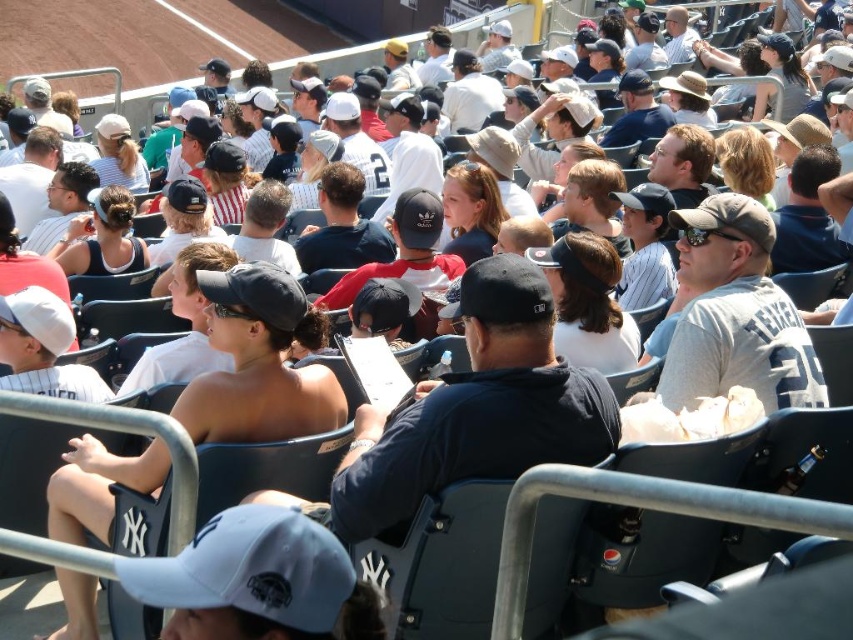
You are sitting in the stands at the baseball stadium and notice a matte black cap at center. Can you determine its exact position using the coordinate system provided?

The matte black cap at center is located at point (259, 362).

You are standing at the center of the baseball stadium and see two points marked in the image. Which point, point (244, 416) or point (787, 381), is closer to you?

Point (244, 416) is closer to you because it is in front of point (787, 381).

You are a photographer at the baseball stadium and want to capture both the matte black cap at center and the matte black tank top at center in the same frame. Which object should you focus on first to ensure both are in the shot?

You should focus on the matte black tank top at center first because the matte black cap at center is positioned to its right, ensuring both are within the frame when centered on the tank top.